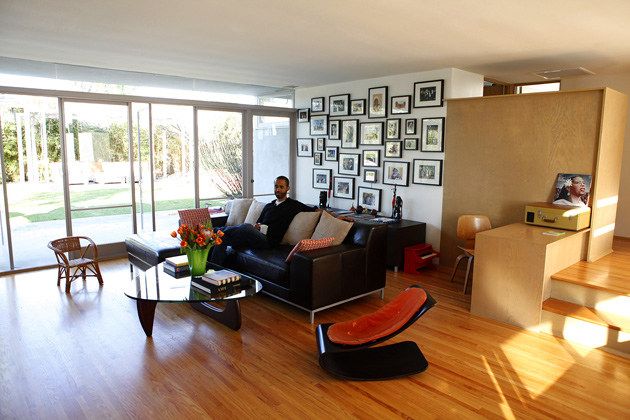
The width and height of the screenshot is (630, 420). Find the location of `places to sit`. places to sit is located at coordinates (72, 255), (258, 251), (465, 240), (353, 330).